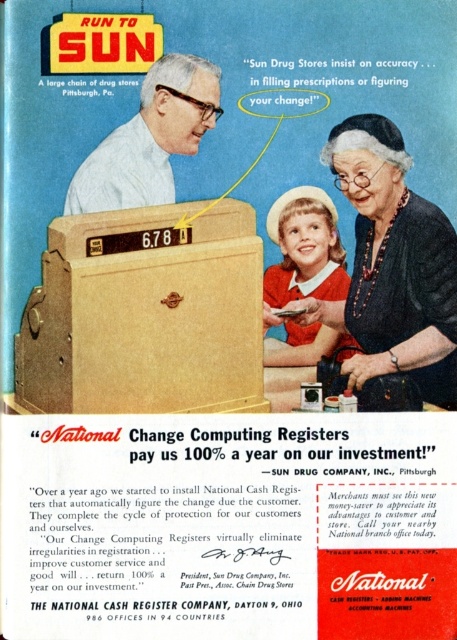
Between point (131, 342) and point (387, 316), which one is positioned behind?

The point (387, 316) is more distant.

Who is positioned more to the right, wooden box at center or matte black dress at center?

From the viewer's perspective, matte black dress at center appears more on the right side.

Measure the distance between wooden box at center and camera.

wooden box at center is 5.77 feet from camera.

Find the location of a particular element. This screenshot has width=457, height=640. wooden box at center is located at coordinates (145, 314).

Is matte black dress at center below matte white shirt at center?

Indeed, matte black dress at center is positioned under matte white shirt at center.

Which of these two, matte black dress at center or matte white shirt at center, stands shorter?

Standing shorter between the two is matte white shirt at center.

Who is more distant from viewer, (366,323) or (168,192)?

Positioned behind is point (366,323).

At what (x,y) coordinates should I click in order to perform the action: click on matte black dress at center. Please return your answer as a coordinate pair (x, y). This screenshot has height=640, width=457. Looking at the image, I should click on (392, 266).

Locate an element on the screen. wooden box at center is located at coordinates (145, 314).

Is point (154, 339) less distant than point (212, 100)?

Yes, it is in front of point (212, 100).

Which is in front, point (251, 211) or point (157, 122)?

Point (251, 211)

At what (x,y) coordinates should I click in order to perform the action: click on wooden box at center. Please return your answer as a coordinate pair (x, y). This screenshot has height=640, width=457. Looking at the image, I should click on (145, 314).